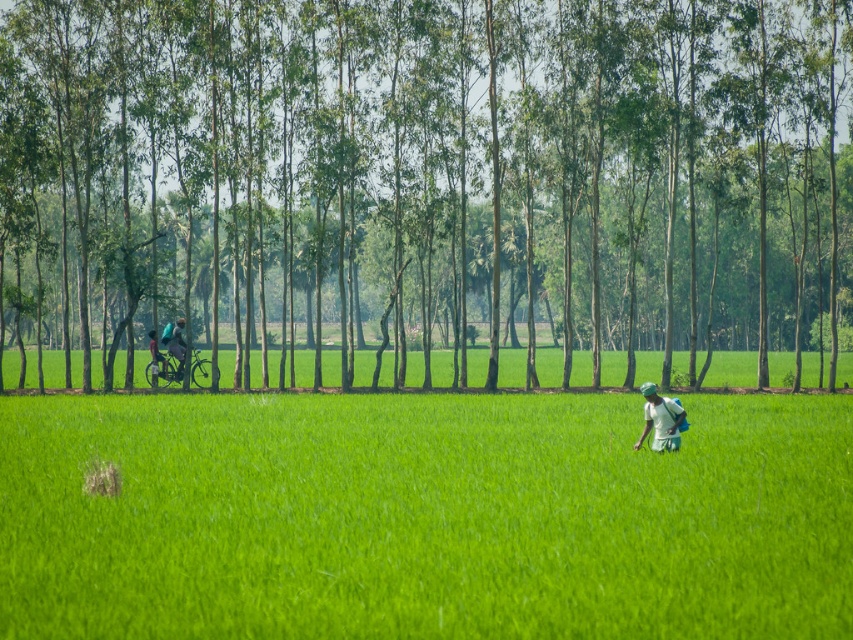
Question: Which of the following is the closest to the observer?

Choices:
 (A) click(503, 230)
 (B) click(647, 413)

Answer: (B)

Question: Which point is closer to the camera?

Choices:
 (A) white fabric shirt at lower right
 (B) green grass at center
 (C) green leafy tree at center
 (D) dark blue fabric bicycle at left

Answer: (B)

Question: Does green leafy tree at center appear on the left side of white fabric shirt at lower right?

Choices:
 (A) yes
 (B) no

Answer: (A)

Question: Which is nearer to the dark blue fabric bicycle at left?

Choices:
 (A) green grass at center
 (B) white fabric shirt at lower right

Answer: (A)

Question: Is green leafy tree at center above dark blue fabric at left?

Choices:
 (A) no
 (B) yes

Answer: (B)

Question: Is green grass at center smaller than white fabric shirt at lower right?

Choices:
 (A) no
 (B) yes

Answer: (A)